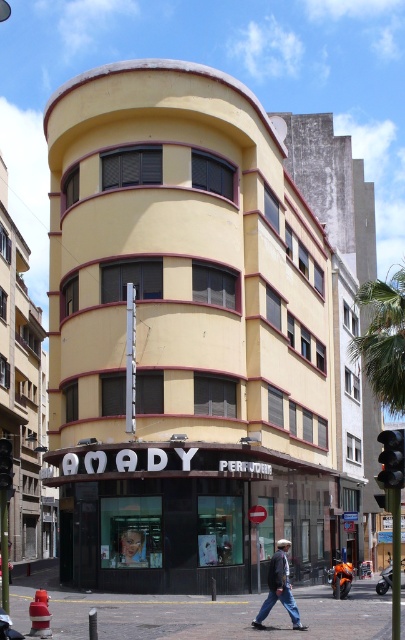
Which is in front, point (402, 282) or point (390, 458)?

Point (390, 458) is more forward.

Does point (385, 328) come closer to viewer compared to point (402, 456)?

No, it is behind (402, 456).

Who is more forward, (394, 394) or (404, 477)?

Point (404, 477)

You are a GUI agent. You are given a task and a screenshot of the screen. Output one action in this format:
    pyautogui.click(x=<x>, y=<y>)
    Task: Click on the green leafy palm tree at upper right
    
    Given the screenshot: What is the action you would take?
    pyautogui.click(x=383, y=339)

Between denim jacket at lower right and black plastic traffic light at center right, which one has less height?

With less height is denim jacket at lower right.

Can you confirm if denim jacket at lower right is bigger than black plastic traffic light at center right?

No, denim jacket at lower right is not bigger than black plastic traffic light at center right.

Is point (281, 548) less distant than point (402, 433)?

No, (281, 548) is further to viewer.

The width and height of the screenshot is (405, 640). What are the coordinates of `denim jacket at lower right` in the screenshot? It's located at (279, 588).

Where is `denim jacket at lower right`? This screenshot has height=640, width=405. denim jacket at lower right is located at coordinates (279, 588).

Can you confirm if denim jacket at lower right is thinner than black plastic traffic light at center?

Correct, denim jacket at lower right's width is less than black plastic traffic light at center's.

Which is in front, point (277, 563) or point (6, 448)?

Positioned in front is point (6, 448).

Where is `denim jacket at lower right`? The image size is (405, 640). denim jacket at lower right is located at coordinates (279, 588).